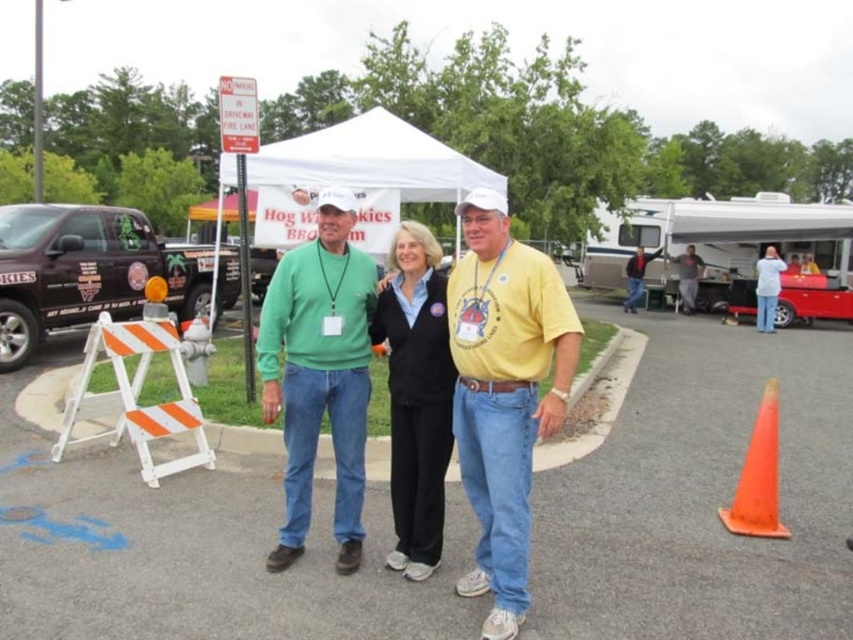
Question: Can you confirm if black matte truck at left is bigger than orange matte traffic cone at lower right?

Choices:
 (A) no
 (B) yes

Answer: (A)

Question: Does white plastic camper at right have a smaller size compared to matte gray shirt at center?

Choices:
 (A) no
 (B) yes

Answer: (A)

Question: Is yellow cotton shirt at center to the left of matte gray shirt at center from the viewer's perspective?

Choices:
 (A) yes
 (B) no

Answer: (A)

Question: Which of the following is the farthest from the observer?

Choices:
 (A) (734, 509)
 (B) (308, 266)
 (C) (724, 346)

Answer: (C)

Question: Among these objects, which one is nearest to the camera?

Choices:
 (A) white fabric canopy at upper center
 (B) black matte truck at left
 (C) matte green sweater at center
 (D) green matte sweater at center

Answer: (C)

Question: Among these objects, which one is nearest to the camera?

Choices:
 (A) green matte sweater at center
 (B) black fleece jacket at center

Answer: (A)